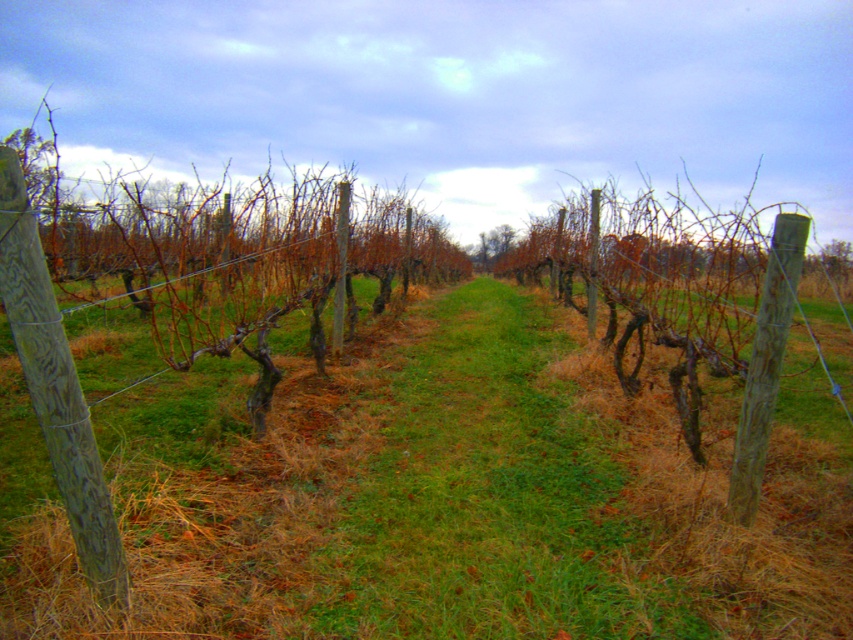
You are a farmer checking the vineyard. You see the green grass at center and the wooden post at left. Which one is more to the left?

The wooden post at left is more to the left because it is positioned to the left of the green grass at center.